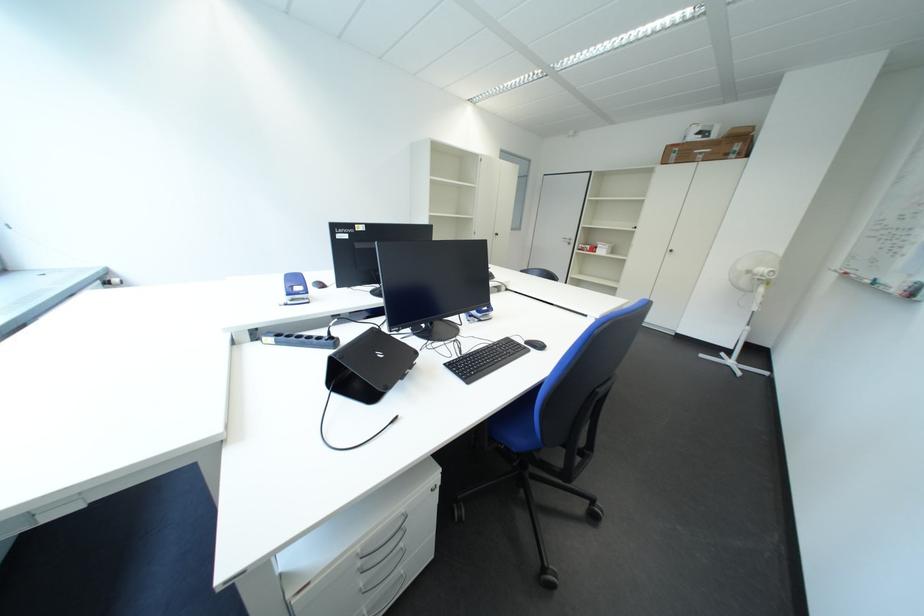
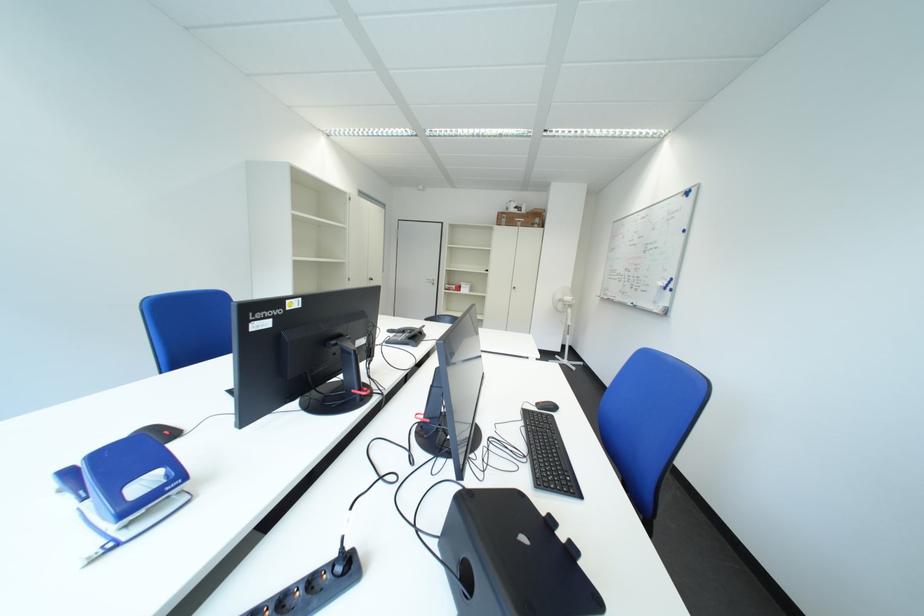
The point at (463, 368) is marked in the first image. Where is the corresponding point in the second image?

(553, 485)